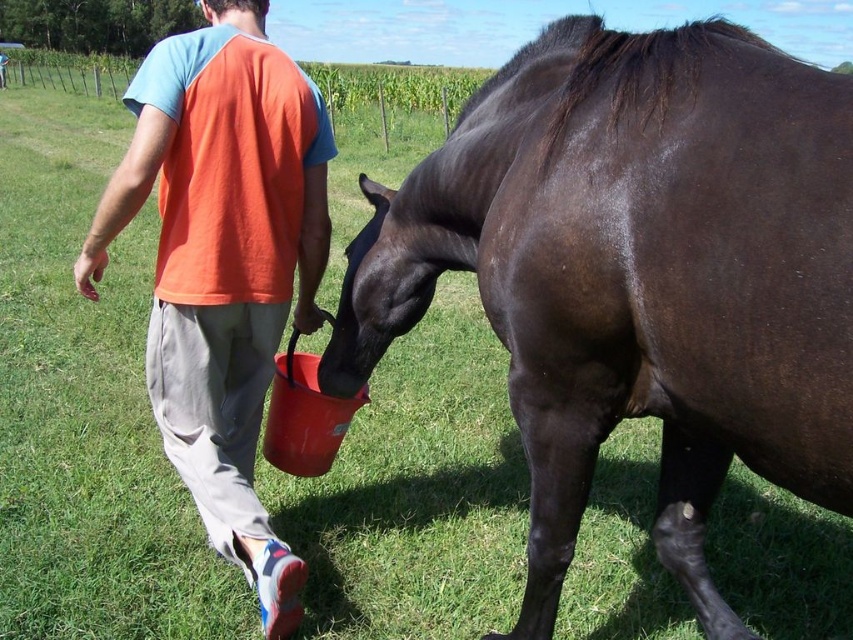
Based on the scene description, where is the shiny dark brown horse at center located in the image?

The shiny dark brown horse at center is located at point 0.430 in the x coordinate and 0.748 in the y coordinate.